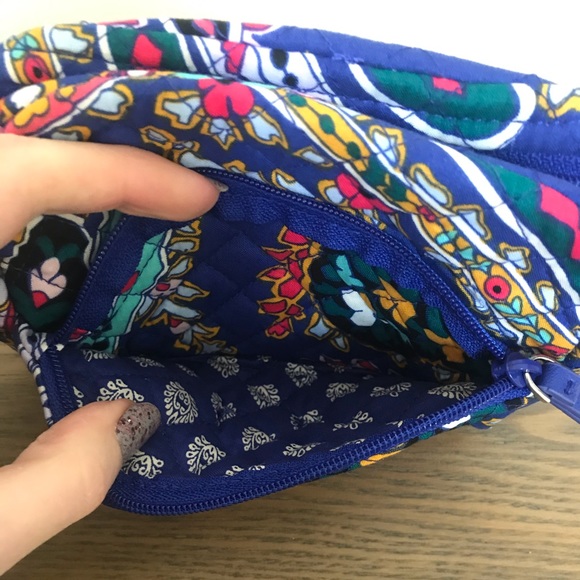
Where is `table`? Image resolution: width=580 pixels, height=580 pixels. table is located at coordinates (x=464, y=528).